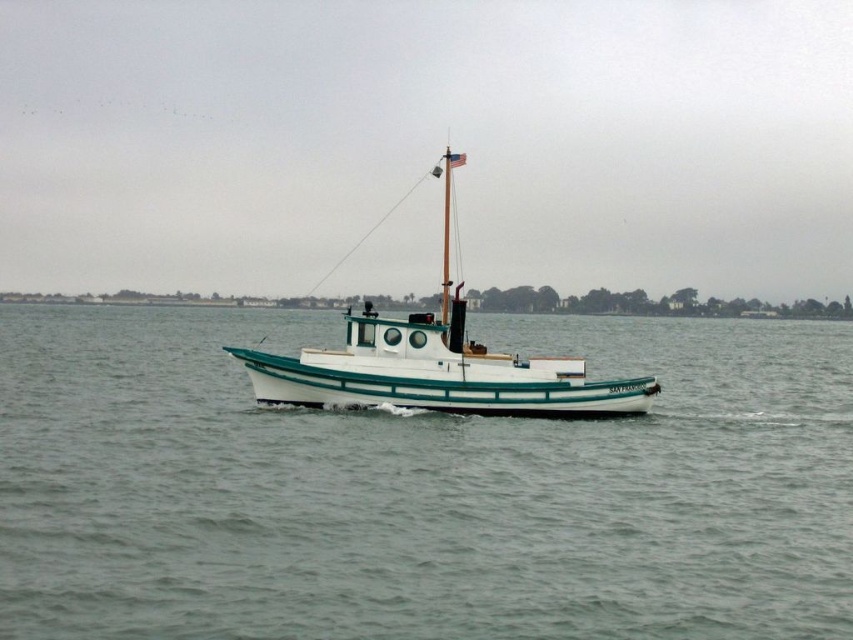
Question: Can you confirm if white matte water at center is bigger than white glossy boat at center?

Choices:
 (A) yes
 (B) no

Answer: (A)

Question: Can you confirm if white matte water at center is bigger than white glossy boat at center?

Choices:
 (A) no
 (B) yes

Answer: (B)

Question: Does white matte water at center have a lesser width compared to white glossy boat at center?

Choices:
 (A) no
 (B) yes

Answer: (A)

Question: Which point is farther to the camera?

Choices:
 (A) (322, 508)
 (B) (248, 365)

Answer: (B)